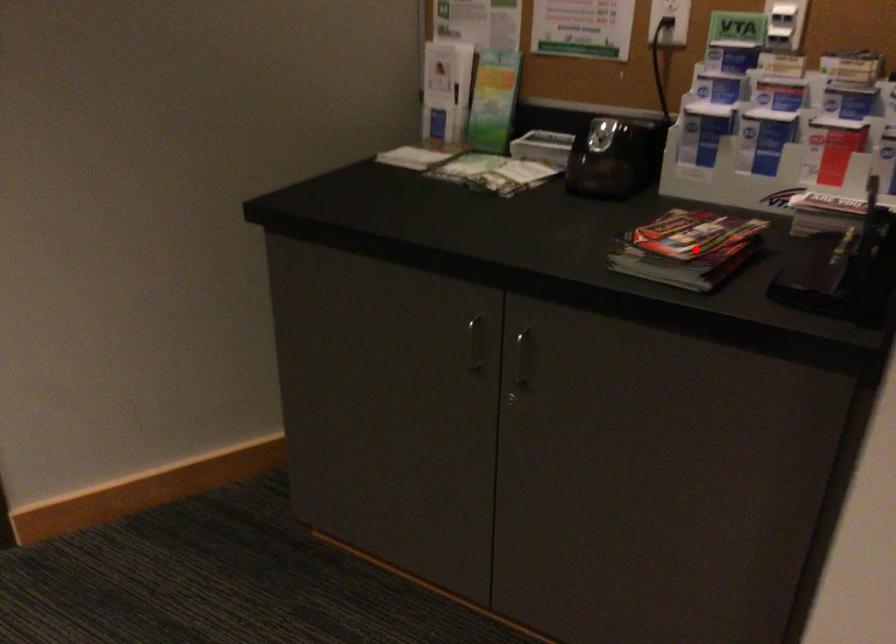
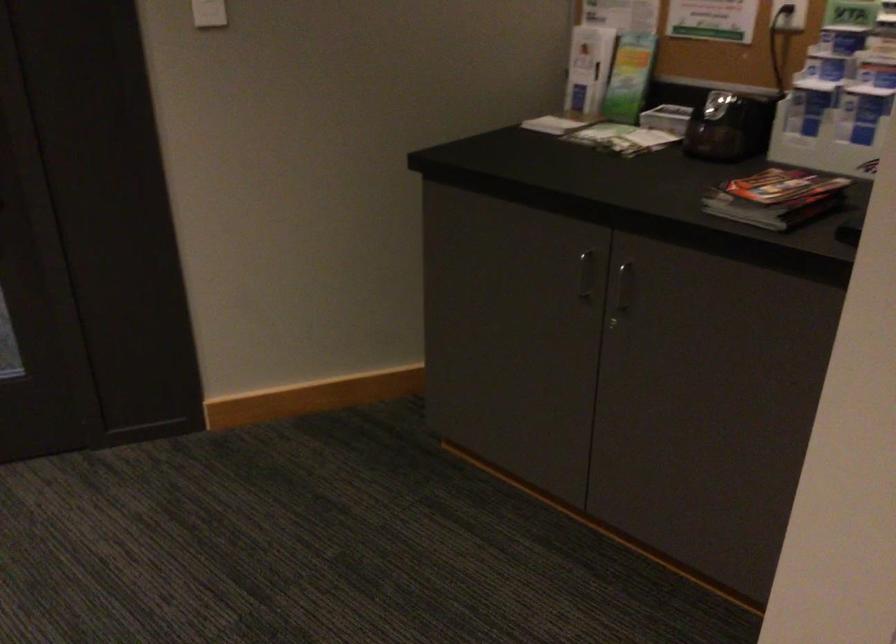
Question: A red point is marked in image1. In image2, is the corresponding 3D point closer to the camera or farther? Reply with the corresponding letter.

Choices:
 (A) The corresponding 3D point is closer.
 (B) The corresponding 3D point is farther.

Answer: (B)